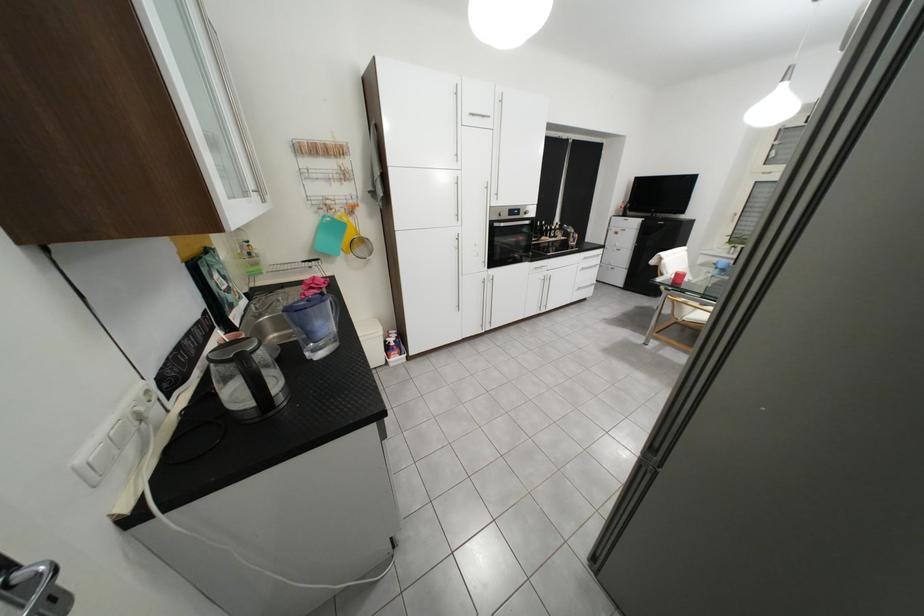
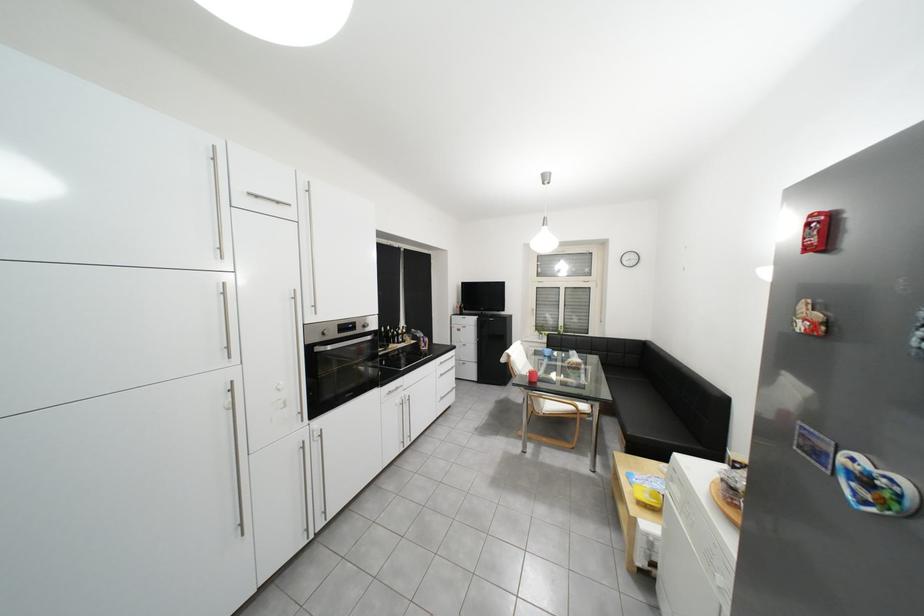
The point at (530, 211) is marked in the first image. Where is the corresponding point in the second image?

(366, 325)